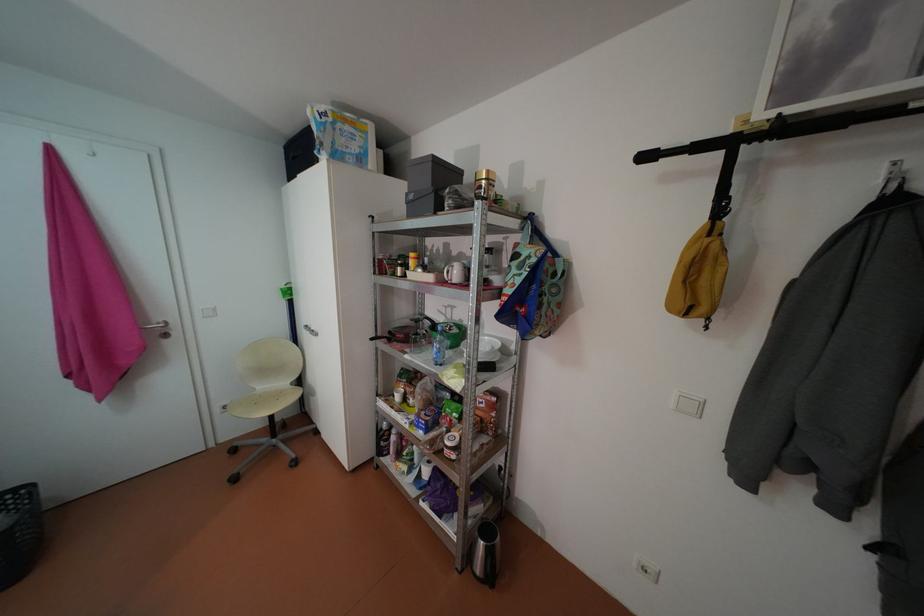
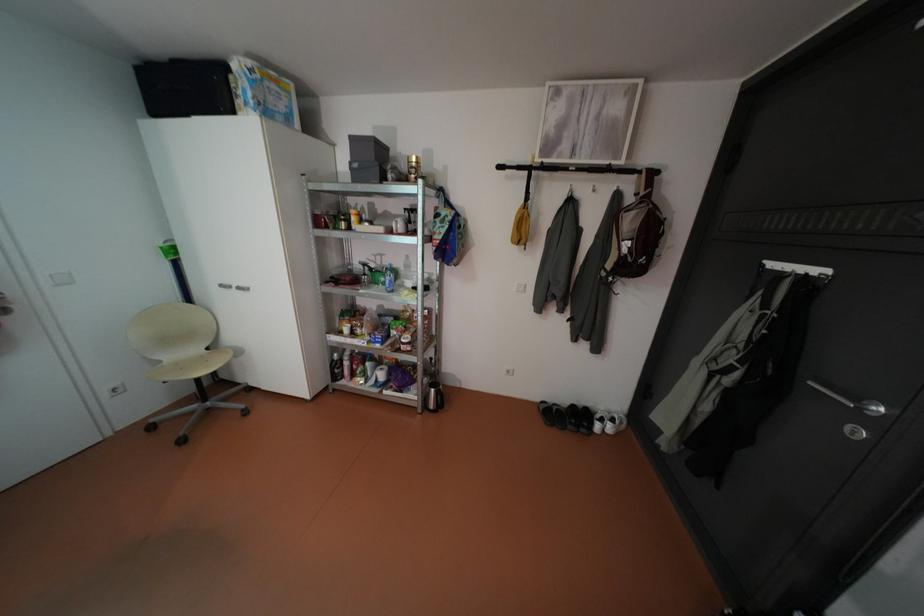
The point at (315, 326) is marked in the first image. Where is the corresponding point in the second image?

(232, 285)